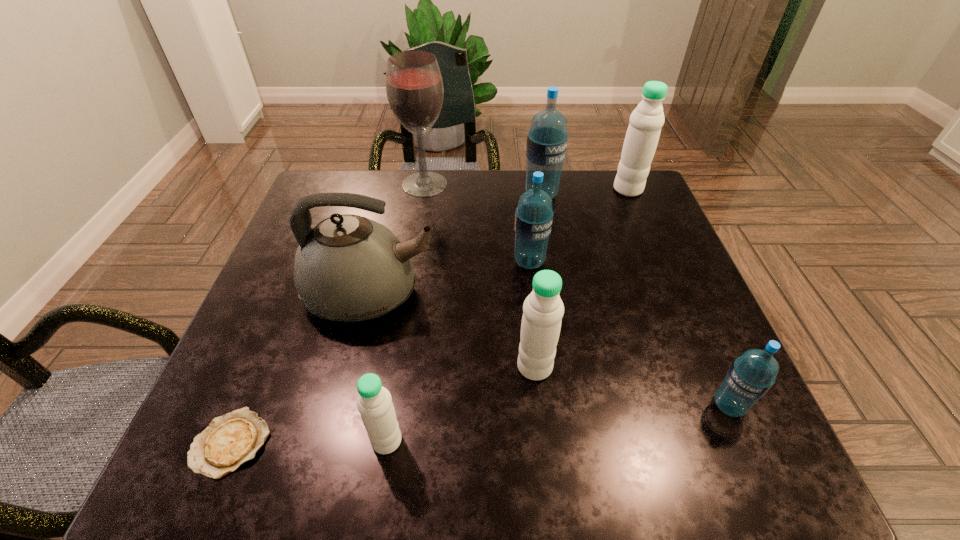
This screenshot has width=960, height=540. What are the coordinates of `object that is at the far right corner` in the screenshot? It's located at (642, 136).

Find the location of `free space at the far edge of the desktop`. free space at the far edge of the desktop is located at coordinates (488, 218).

This screenshot has width=960, height=540. In the image, there is a desktop. Find the location of `free space at the left edge`. free space at the left edge is located at coordinates (327, 321).

The width and height of the screenshot is (960, 540). In order to click on vacant point at the right edge in this screenshot , I will do `click(645, 323)`.

Where is `vacant space at the far left corner of the desktop`? The width and height of the screenshot is (960, 540). vacant space at the far left corner of the desktop is located at coordinates (347, 210).

Image resolution: width=960 pixels, height=540 pixels. I want to click on vacant space at the far right corner of the desktop, so click(629, 197).

At what (x,y) coordinates should I click in order to perform the action: click on vacant space that is in between the brown quiche and the biggest white water bottle. Please return your answer as a coordinate pair (x, y). The width and height of the screenshot is (960, 540). Looking at the image, I should click on (430, 316).

In order to click on vacant area that lies between the quiche and the farthest white water bottle in this screenshot , I will do `click(430, 316)`.

Image resolution: width=960 pixels, height=540 pixels. In order to click on empty space between the fourth nearest object and the red alcohol in this screenshot , I will do `click(480, 275)`.

You are a GUI agent. You are given a task and a screenshot of the screen. Output one action in this format:
    pyautogui.click(x=<x>, y=<y>)
    Task: Click on the free point between the alcohol and the rightmost blue water bottle
    The width and height of the screenshot is (960, 540).
    Given the screenshot: What is the action you would take?
    577,295